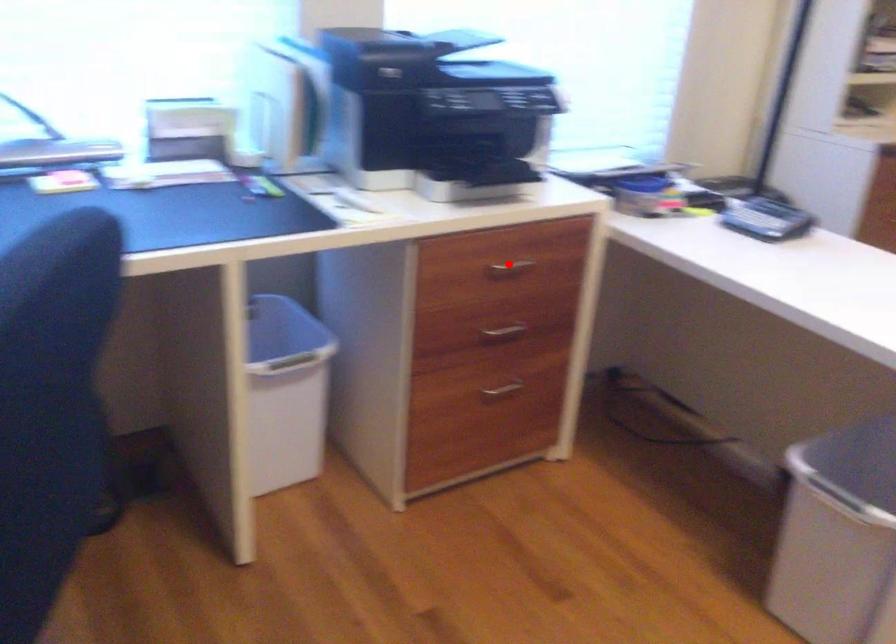
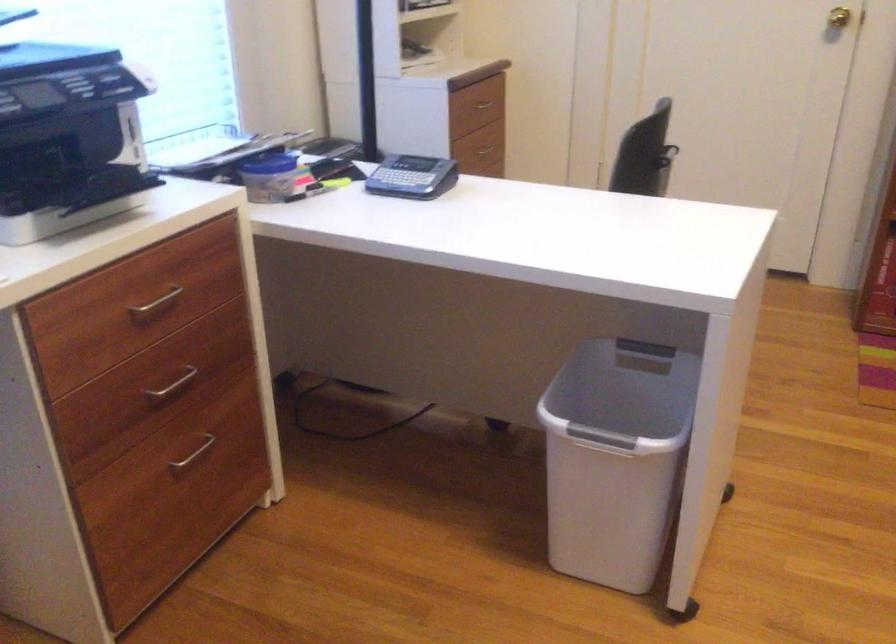
Locate, in the second image, the point that corresponds to the highlighted location in the first image.

(156, 303)